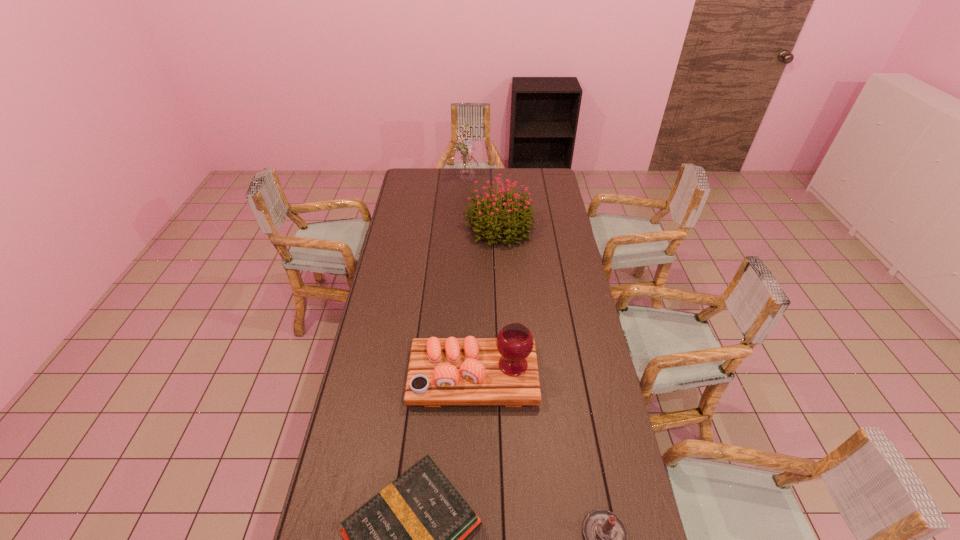
Locate an element on the screen. This screenshot has width=960, height=540. the farther bouquet is located at coordinates (466, 166).

Identify the location of the shorter bouquet. (516, 216).

Find the location of a particular element. This screenshot has height=540, width=960. the nearer bouquet is located at coordinates (516, 216).

Find the location of a particular element. platter is located at coordinates (503, 371).

Locate an element on the screen. the third tallest object is located at coordinates (503, 371).

I want to click on free spot located 0.120m on the front-facing side of the farther bouquet, so click(499, 178).

At what (x,y) coordinates should I click in order to perform the action: click on vacant space located 0.400m on the front of the second tallest object. Please return your answer as a coordinate pair (x, y). Looking at the image, I should click on (504, 312).

Identify the location of free location located 0.080m on the right of the platter. The image size is (960, 540). (559, 376).

What are the coordinates of `object present at the far edge` in the screenshot? It's located at (466, 166).

The height and width of the screenshot is (540, 960). Find the location of `object present at the right edge`. object present at the right edge is located at coordinates tap(516, 216).